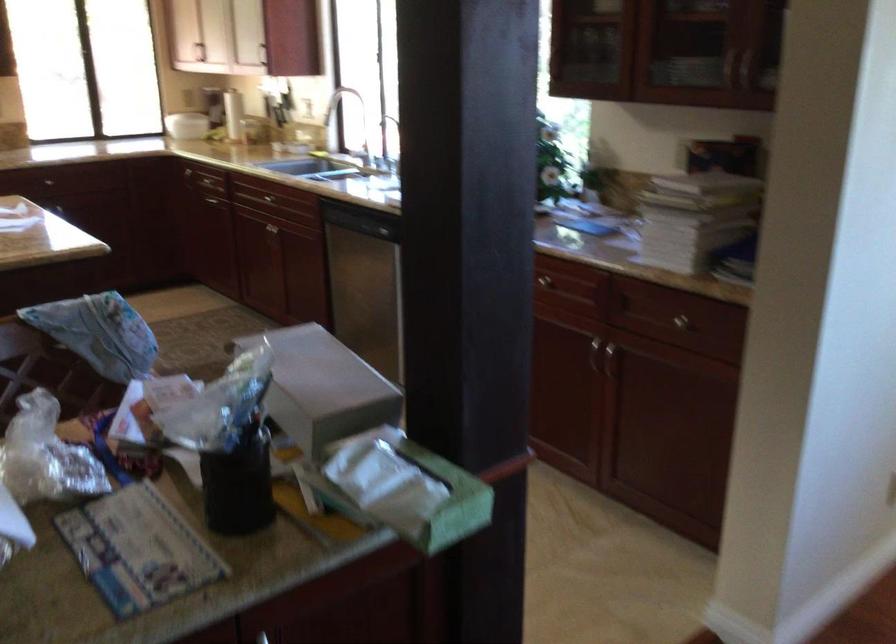
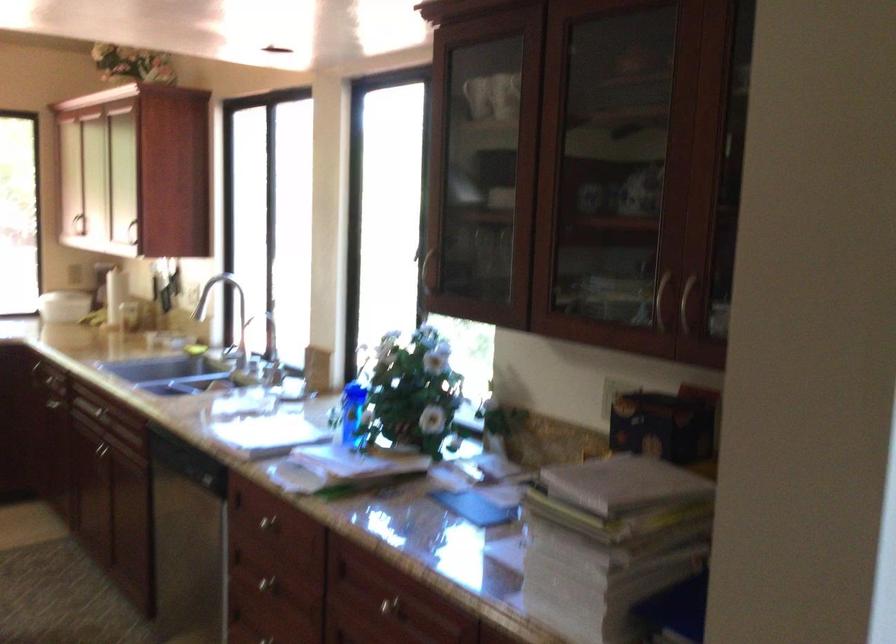
In the second image, find the point that corresponds to point (545, 285) in the first image.

(386, 605)